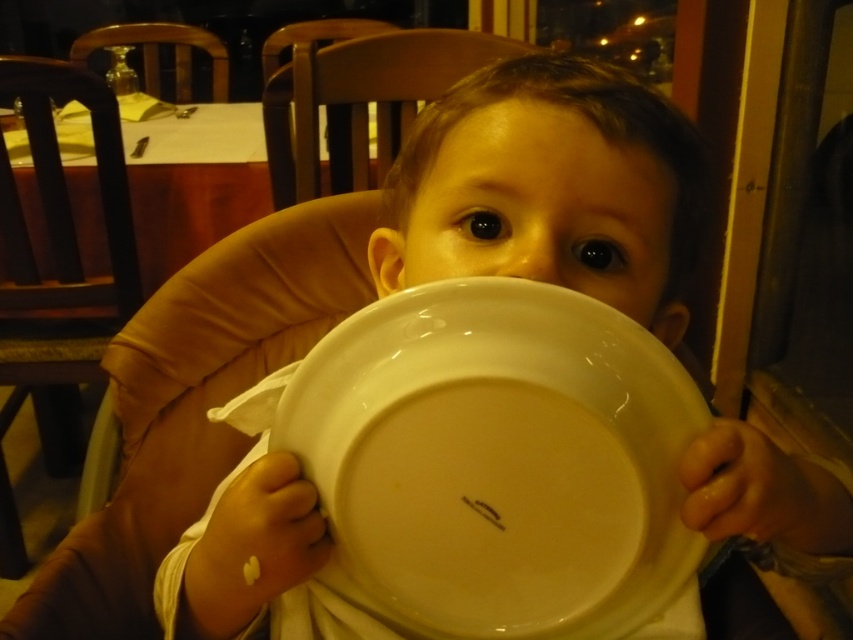
Question: Which point is farther from the camera taking this photo?

Choices:
 (A) (384, 29)
 (B) (474, 147)

Answer: (A)

Question: Is wooden chair at left to the right of wooden chair at upper center from the viewer's perspective?

Choices:
 (A) no
 (B) yes

Answer: (A)

Question: Where is smooth skin face at center located in relation to wooden chair at upper left in the image?

Choices:
 (A) below
 (B) above

Answer: (A)

Question: Which point is closer to the camera taking this photo?

Choices:
 (A) (633, 209)
 (B) (311, 161)
 (C) (151, 92)

Answer: (A)

Question: Is smooth skin face at center to the left of wooden chair at upper center from the viewer's perspective?

Choices:
 (A) yes
 (B) no

Answer: (B)

Question: Which point appears closest to the camera in this image?

Choices:
 (A) (105, 26)
 (B) (509, 212)

Answer: (B)